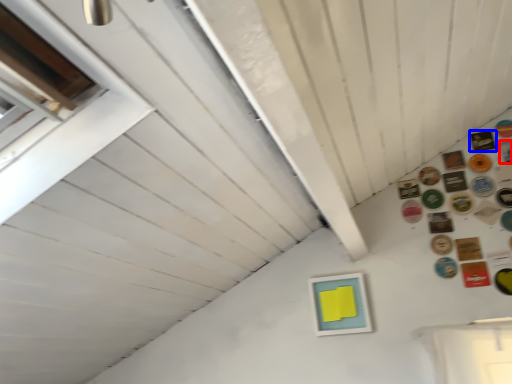
Question: Which object is further to the camera taking this photo, button (highlighted by a red box) or button (highlighted by a blue box)?

Choices:
 (A) button
 (B) button

Answer: (B)